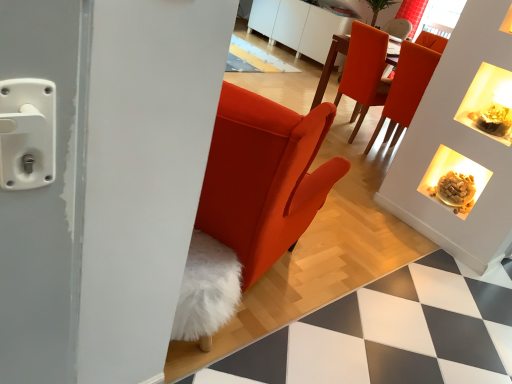
Question: Considering the relative sizes of red velvet curtain at upper center and matte white fireplace at upper right in the image provided, is red velvet curtain at upper center thinner than matte white fireplace at upper right?

Choices:
 (A) yes
 (B) no

Answer: (B)

Question: Does red velvet curtain at upper center contain matte white fireplace at upper right?

Choices:
 (A) yes
 (B) no

Answer: (B)

Question: Can you confirm if red velvet curtain at upper center is smaller than matte white fireplace at upper right?

Choices:
 (A) no
 (B) yes

Answer: (A)

Question: Considering the relative positions of red velvet curtain at upper center and matte white fireplace at upper right in the image provided, is red velvet curtain at upper center to the right of matte white fireplace at upper right from the viewer's perspective?

Choices:
 (A) no
 (B) yes

Answer: (B)

Question: Can you confirm if red velvet curtain at upper center is shorter than matte white fireplace at upper right?

Choices:
 (A) no
 (B) yes

Answer: (A)

Question: In the image, is matte orange chair at upper right, which ranks as the second chair in left-to-right order, on the left side or the right side of matte orange chair at upper right, the first chair viewed from the left?

Choices:
 (A) left
 (B) right

Answer: (B)

Question: From a real-world perspective, is matte orange chair at upper right, which ranks as the second chair in left-to-right order, positioned above or below matte orange chair at upper right, positioned as the second chair in right-to-left order?

Choices:
 (A) below
 (B) above

Answer: (B)

Question: Considering the positions of point (398, 135) and point (369, 82), is point (398, 135) closer or farther from the camera than point (369, 82)?

Choices:
 (A) closer
 (B) farther

Answer: (B)

Question: Choose the correct answer: Is matte orange chair at upper right, which appears as the first chair when viewed from the right, inside matte orange chair at upper right, positioned as the second chair in right-to-left order, or outside it?

Choices:
 (A) inside
 (B) outside

Answer: (B)

Question: From their relative heights in the image, would you say red velvet curtain at upper center is taller or shorter than matte orange chair at upper right, positioned as the second chair in right-to-left order?

Choices:
 (A) tall
 (B) short

Answer: (B)

Question: Visually, is red velvet curtain at upper center positioned to the left or to the right of matte orange chair at upper right, the first chair viewed from the left?

Choices:
 (A) right
 (B) left

Answer: (A)

Question: Is red velvet curtain at upper center bigger or smaller than matte orange chair at upper right, positioned as the second chair in right-to-left order?

Choices:
 (A) big
 (B) small

Answer: (B)

Question: Is red velvet curtain at upper center situated inside matte orange chair at upper right, positioned as the second chair in right-to-left order, or outside?

Choices:
 (A) outside
 (B) inside

Answer: (A)

Question: Is matte white fireplace at upper right wider or thinner than matte orange chair at upper right, which appears as the first chair when viewed from the right?

Choices:
 (A) thin
 (B) wide

Answer: (A)

Question: From the image's perspective, relative to matte orange chair at upper right, which appears as the first chair when viewed from the right, is matte white fireplace at upper right above or below?

Choices:
 (A) above
 (B) below

Answer: (B)